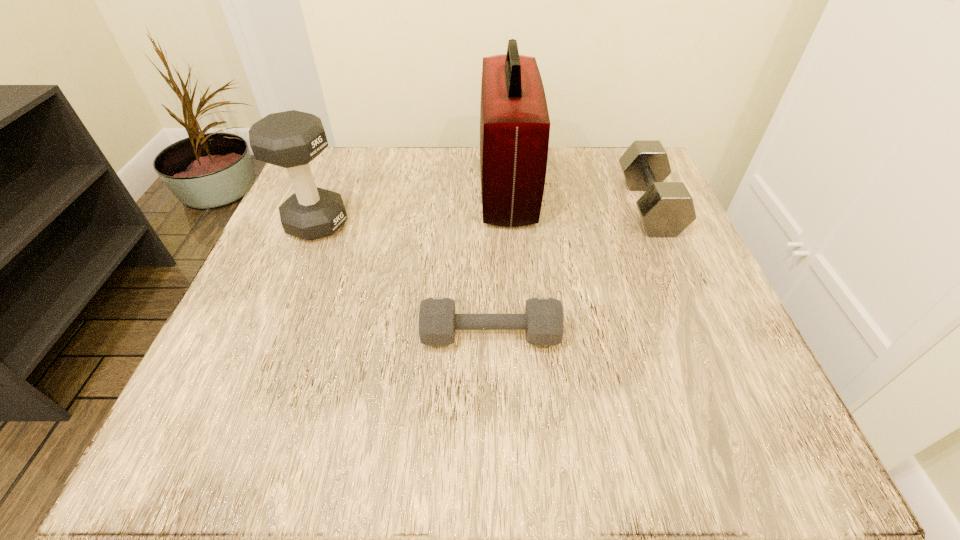
I want to click on free area in between the second dumbbell from left to right and the second tallest object, so click(x=403, y=279).

Identify the location of vacant space that's between the leftmost object and the rightmost dumbbell. (483, 214).

Identify the location of free point between the nearest object and the rightmost object. The image size is (960, 540). (569, 271).

Where is `vacant space that is in between the tallest object and the nearest object`? vacant space that is in between the tallest object and the nearest object is located at coordinates (499, 261).

Identify which object is the nearest to the nearest object. Please provide its 2D coordinates. Your answer should be formatted as a tuple, i.e. [(x, y)], where the tuple contains the x and y coordinates of a point satisfying the conditions above.

[(514, 121)]

The height and width of the screenshot is (540, 960). Identify the location of object that is the second closest to the leftmost object. (514, 121).

Locate which dumbbell is the closest to the rightmost object. Please provide its 2D coordinates. Your answer should be formatted as a tuple, i.e. [(x, y)], where the tuple contains the x and y coordinates of a point satisfying the conditions above.

[(543, 320)]

You are a GUI agent. You are given a task and a screenshot of the screen. Output one action in this format:
    pyautogui.click(x=<x>, y=<y>)
    Task: Click on the dumbbell that stands as the second closest to the nearest object
    This screenshot has width=960, height=540.
    Given the screenshot: What is the action you would take?
    pyautogui.click(x=666, y=209)

This screenshot has height=540, width=960. I want to click on free region that satisfies the following two spatial constraints: 1. on the side of the first aid kit with the cross symbol; 2. on the back side of the second tallest dumbbell, so click(509, 206).

The image size is (960, 540). Identify the location of vacant space that satisfies the following two spatial constraints: 1. on the back side of the second tallest dumbbell; 2. on the side of the tallest object with the cross symbol. (640, 187).